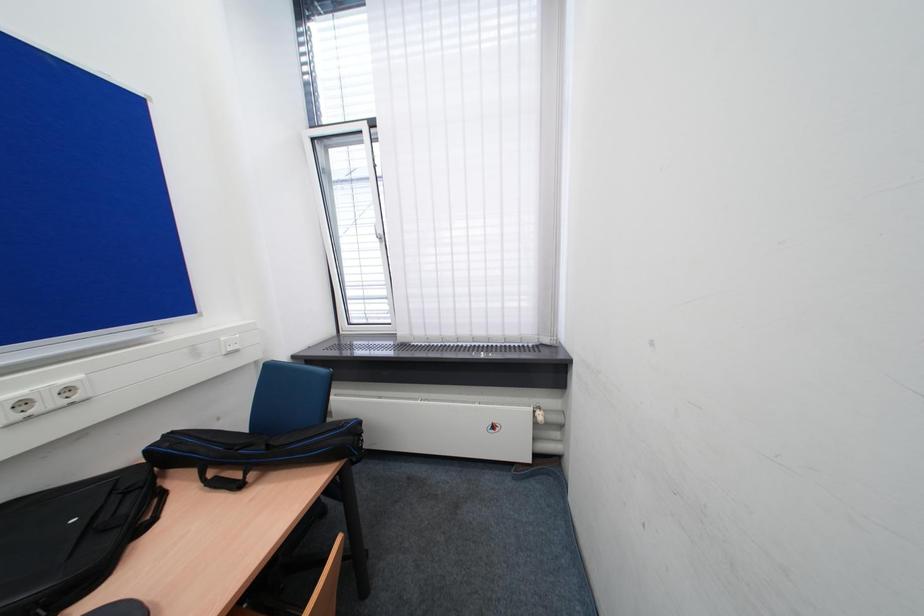
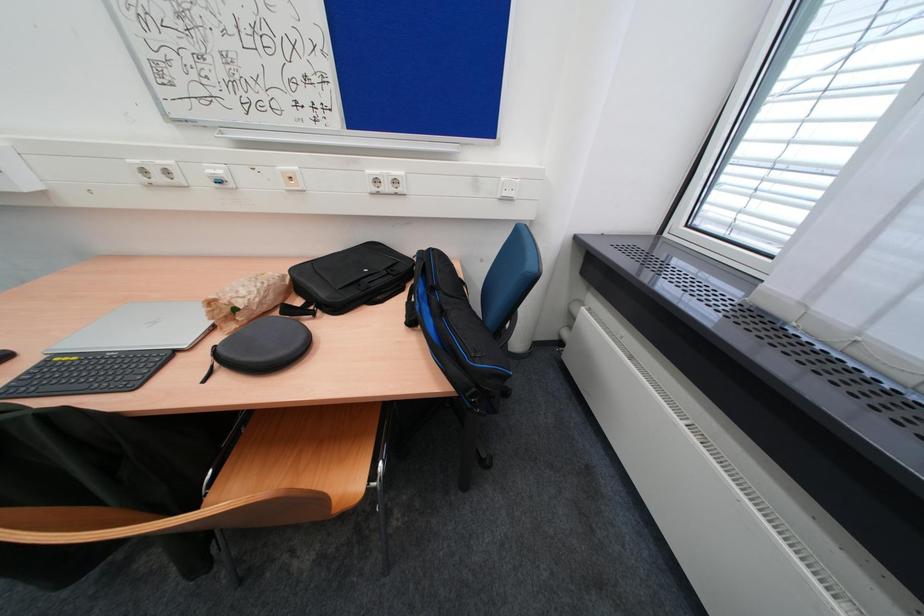
The images are taken continuously from a first-person perspective. In which direction is your viewpoint rotating?

The rotation direction of the camera is left-down.